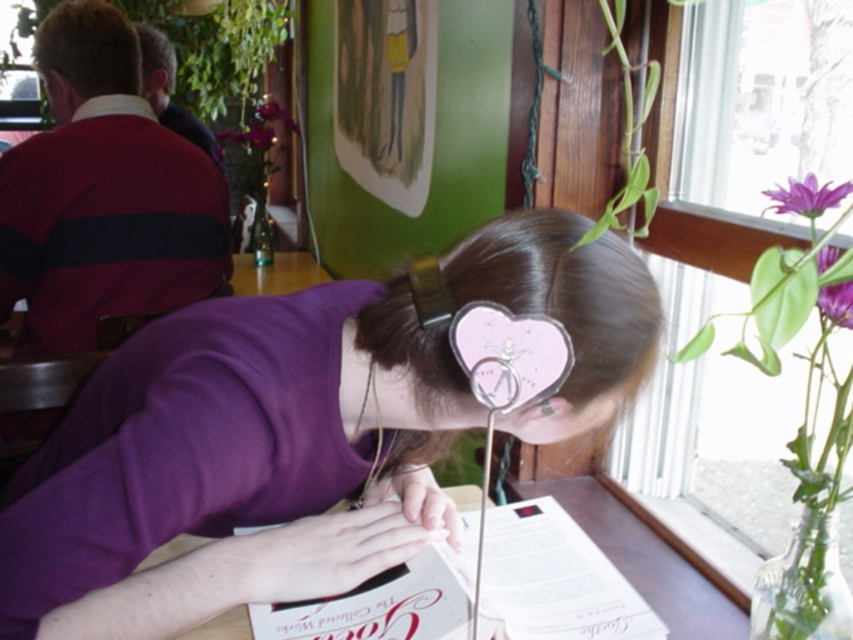
Is purple matte shirt at center thinner than purple matte flower at upper right?

Incorrect, purple matte shirt at center's width is not less than purple matte flower at upper right's.

What do you see at coordinates (234, 461) in the screenshot?
I see `purple matte shirt at center` at bounding box center [234, 461].

Identify the location of purple matte shirt at center. The width and height of the screenshot is (853, 640). (234, 461).

From the picture: Is purple matte shirt at center closer to camera compared to purple paper heart at upper right?

Yes, purple matte shirt at center is closer to the viewer.

Who is more forward, (370, 529) or (804, 189)?

Point (804, 189) is more forward.

Where is `purple matte shirt at center`? This screenshot has height=640, width=853. purple matte shirt at center is located at coordinates (234, 461).

In order to click on purple matte shirt at center in this screenshot , I will do `click(234, 461)`.

This screenshot has height=640, width=853. Describe the element at coordinates (234, 461) in the screenshot. I see `purple matte shirt at center` at that location.

Is purple matte shirt at center to the right of white paper menu at lower center from the viewer's perspective?

In fact, purple matte shirt at center is to the left of white paper menu at lower center.

Between point (126, 429) and point (524, 624), which one is positioned behind?

The point (524, 624) is more distant.

Identify the location of purple matte shirt at center. The image size is (853, 640). (234, 461).